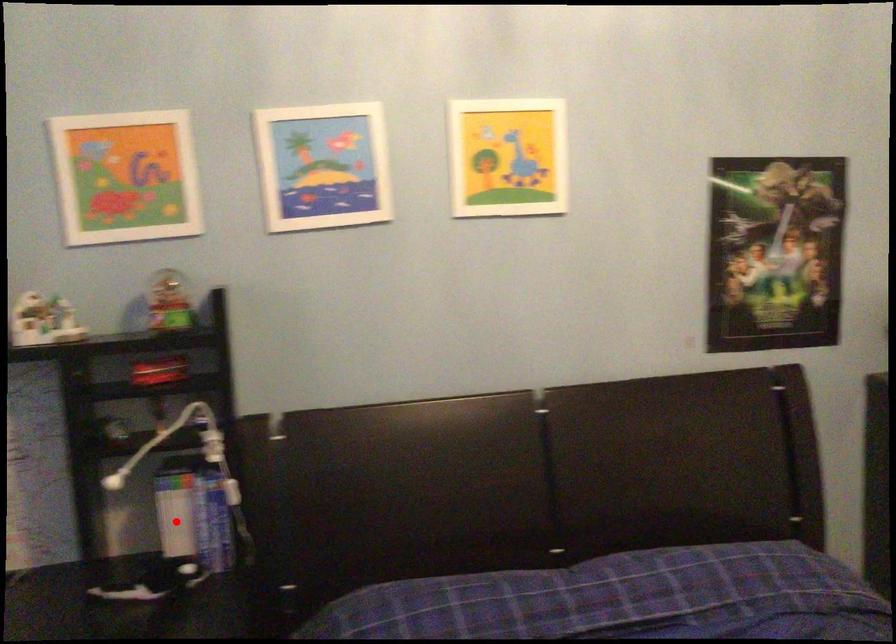
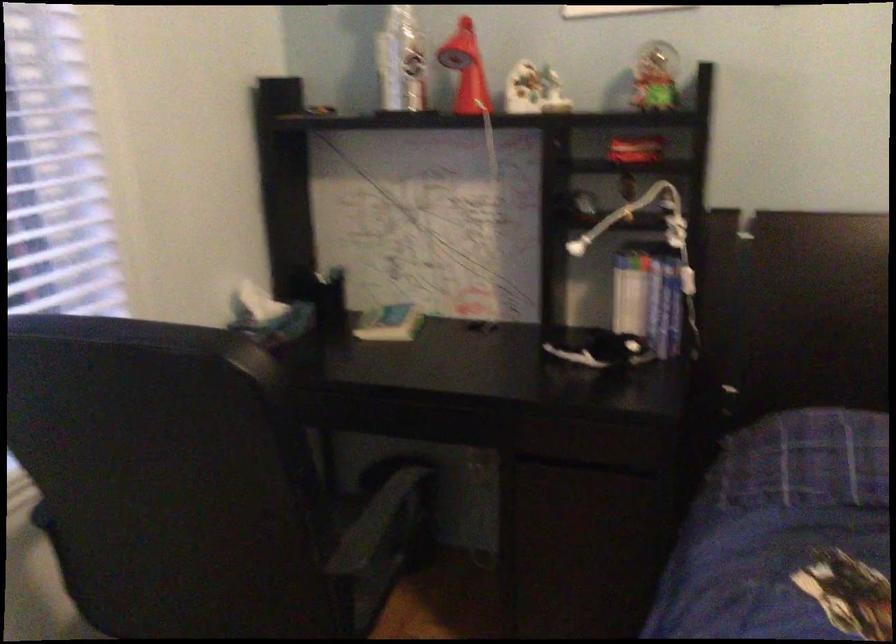
The point at the highlighted location is marked in the first image. Where is the corresponding point in the second image?

(629, 301)